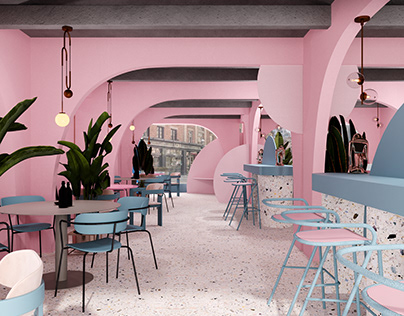
Where is `chair's backrest`? The width and height of the screenshot is (404, 316). chair's backrest is located at coordinates (104, 227), (135, 202).